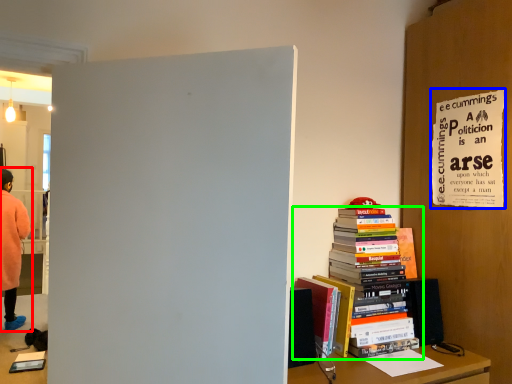
Question: Which is farther away from person (highlighted by a red box)? poster page (highlighted by a blue box) or book (highlighted by a green box)?

Choices:
 (A) poster page
 (B) book

Answer: (A)